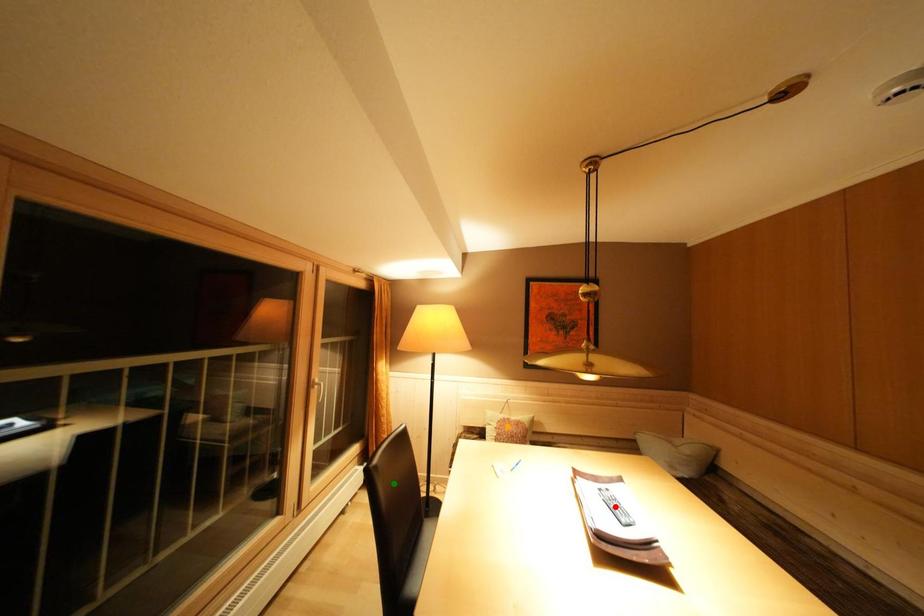
Order these from nearest to farthest:
1. orange point
2. green point
3. red point

1. red point
2. green point
3. orange point